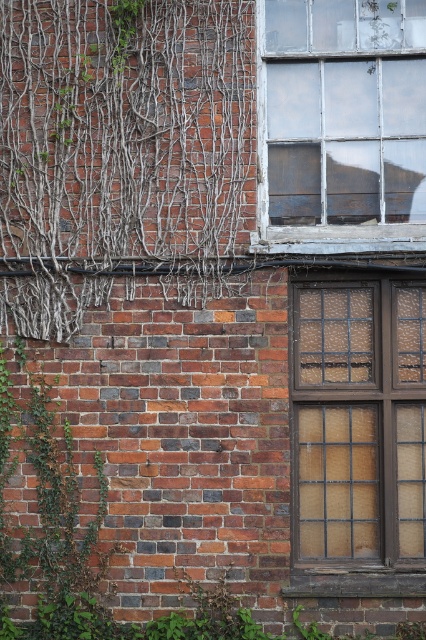
You are an architect designing a new building and want to incorporate elements from this brick wall scene. If you want to ensure that the brown wooden window at center and the white painted wood window frame at upper right are proportionally accurate in your design, which one should you make taller?

The brown wooden window at center should be made taller than the white painted wood window frame at upper right, as the description states that the brown wooden window at center is much taller as white painted wood window frame at upper right.

You are standing in front of the brick wall with a window. There is a point marked at coordinates (357, 435). Which object from the scene does this point belong to?

The point at coordinates (357, 435) is on the brown wooden window at center.